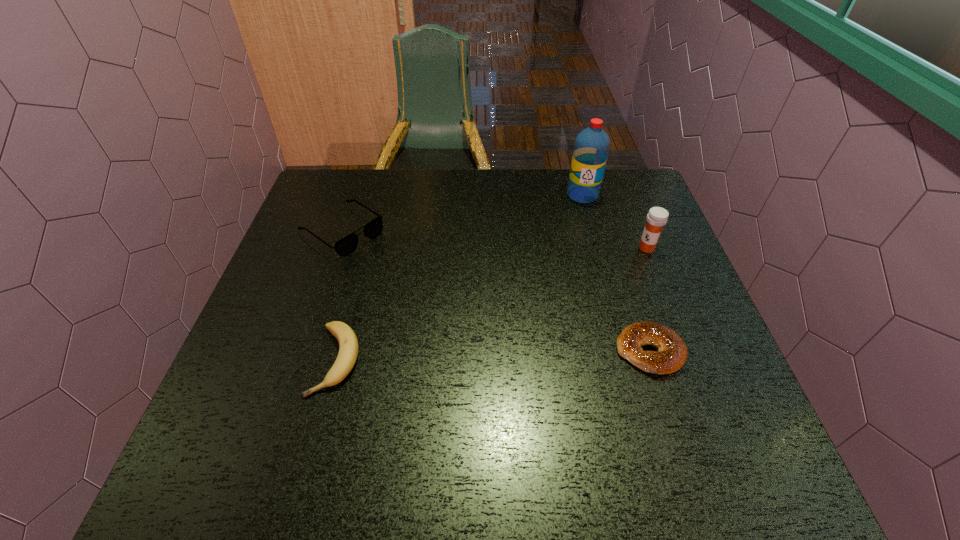
Where is `blank region between the tallest object and the second tallest object`? Image resolution: width=960 pixels, height=540 pixels. blank region between the tallest object and the second tallest object is located at coordinates (614, 221).

Locate an element on the screen. This screenshot has height=540, width=960. object that is the fourth closest one to the banana is located at coordinates coord(657,217).

Identify the location of object identified as the second closest to the spectacles. (591, 148).

Find the location of a particular element. This screenshot has height=540, width=960. free space that satisfies the following two spatial constraints: 1. on the back side of the bagel; 2. on the left side of the medicine is located at coordinates (616, 248).

Where is `vacant space that satisfies the following two spatial constraints: 1. on the front side of the fourth shortest object; 2. on the right side of the farthest object`? vacant space that satisfies the following two spatial constraints: 1. on the front side of the fourth shortest object; 2. on the right side of the farthest object is located at coordinates (597, 248).

The height and width of the screenshot is (540, 960). Find the location of `free space that satisfies the following two spatial constraints: 1. on the front side of the medicine; 2. on the left side of the third shortest object`. free space that satisfies the following two spatial constraints: 1. on the front side of the medicine; 2. on the left side of the third shortest object is located at coordinates (336, 248).